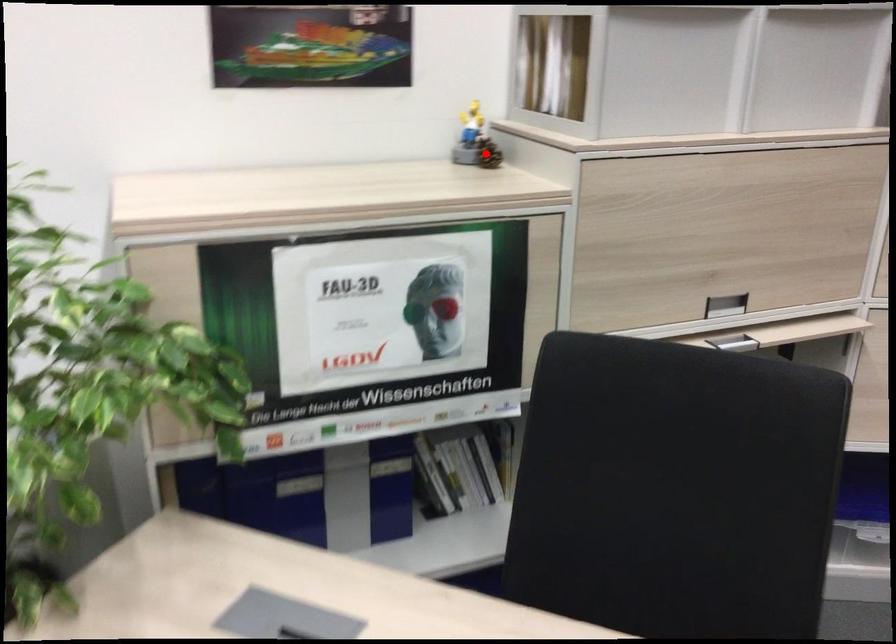
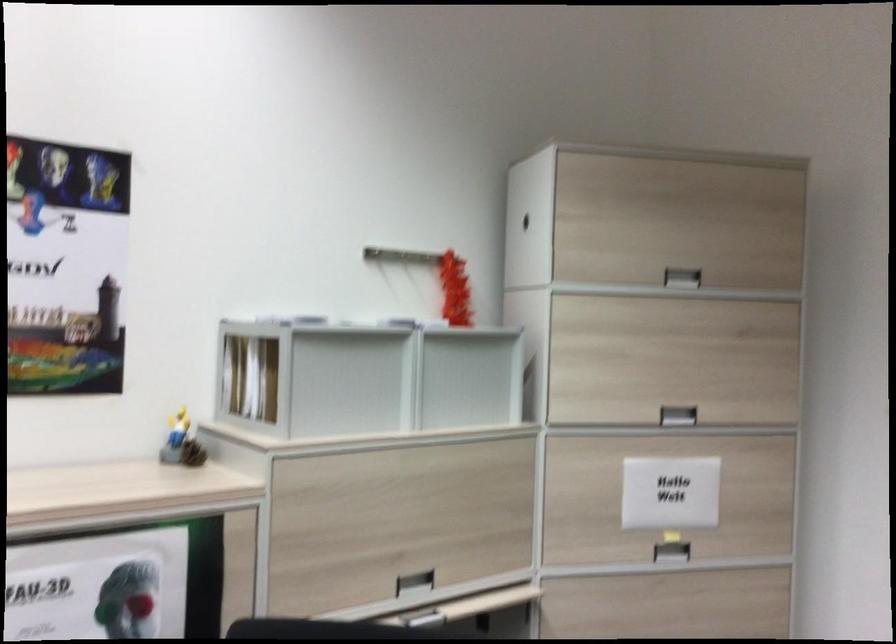
Locate, in the second image, the point that corresponds to the highlighted location in the first image.

(192, 453)